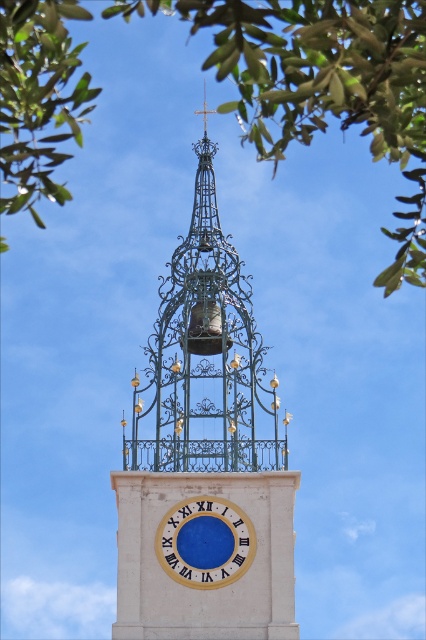
Is green leafy tree at upper center positioned at the back of green leafy tree at upper left?

No, it is not.

This screenshot has height=640, width=426. What do you see at coordinates (324, 83) in the screenshot?
I see `green leafy tree at upper center` at bounding box center [324, 83].

Is point (405, 108) positioned before point (17, 116)?

That is True.

You are a GUI agent. You are given a task and a screenshot of the screen. Output one action in this format:
    pyautogui.click(x=<x>, y=<y>)
    Task: Click on the green leafy tree at upper center
    The image size is (426, 640).
    Given the screenshot: What is the action you would take?
    pyautogui.click(x=324, y=83)

Which of these two, green leafy tree at upper center or blue wooden clock at center, stands taller?

green leafy tree at upper center

Is green leafy tree at upper center behind blue wooden clock at center?

No, green leafy tree at upper center is closer to the viewer.

What do you see at coordinates (324, 83) in the screenshot? I see `green leafy tree at upper center` at bounding box center [324, 83].

Locate an element on the screen. Image resolution: width=426 pixels, height=640 pixels. green leafy tree at upper center is located at coordinates (324, 83).

Who is taller, metallic wirework clock tower at center or blue wooden clock at center?

Standing taller between the two is metallic wirework clock tower at center.

Identify the location of metallic wirework clock tower at center. (204, 456).